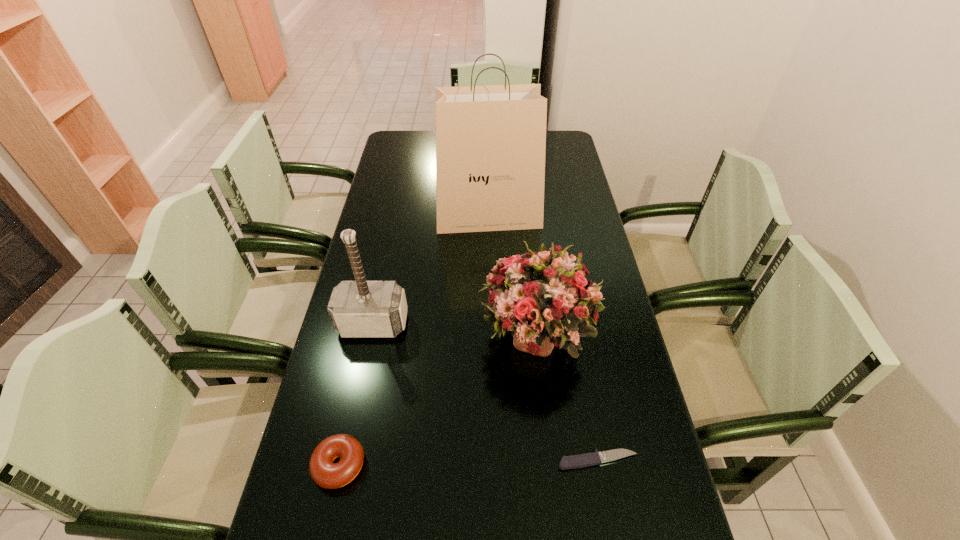
You are a GUI agent. You are given a task and a screenshot of the screen. Output one action in this format:
    pyautogui.click(x=<x>, y=<y>)
    Task: Click on the tallest object
    
    Given the screenshot: What is the action you would take?
    pyautogui.click(x=490, y=140)

The width and height of the screenshot is (960, 540). What are the coordinates of `the farthest object` in the screenshot? It's located at (490, 140).

Find the location of `hammer`. hammer is located at coordinates (360, 308).

In order to click on bouquet in this screenshot , I will do `click(543, 298)`.

Image resolution: width=960 pixels, height=540 pixels. In order to click on the second shortest object in this screenshot , I will do `click(325, 473)`.

Identify the location of steak knife. (588, 459).

Where is `vacant space located 0.140m on the right of the farthest object`? vacant space located 0.140m on the right of the farthest object is located at coordinates (581, 217).

This screenshot has width=960, height=540. In order to click on vacant space located for striking with the head of the hammer in this screenshot , I will do `click(347, 451)`.

I want to click on free space located 0.060m on the back of the bouquet, so click(x=529, y=276).

Locate an element on the screen. The image size is (960, 540). vacant point located on the front of the second shortest object is located at coordinates (324, 536).